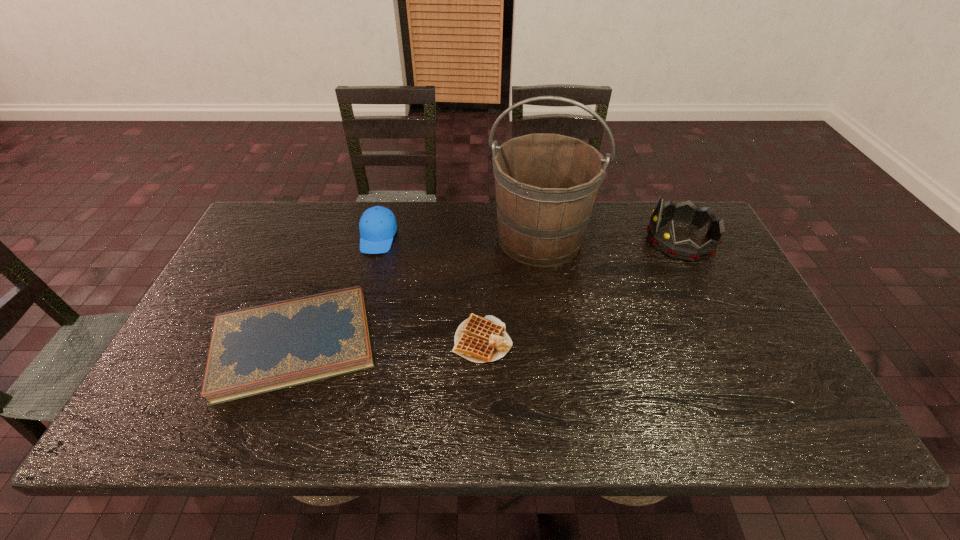
Identify the location of free space located on the front-facing side of the third shortest object. (348, 355).

Locate an element on the screen. The width and height of the screenshot is (960, 540). free space located on the right of the paperback book is located at coordinates (427, 344).

Find the location of a particular element. Image resolution: width=960 pixels, height=540 pixels. vacant space situated on the left of the waffle is located at coordinates (348, 340).

Where is `bucket that is at the far edge`? This screenshot has height=540, width=960. bucket that is at the far edge is located at coordinates (546, 184).

Identify the location of tiara situated at the far edge. (663, 239).

Find the location of a particular element. The height and width of the screenshot is (540, 960). cap situated at the far edge is located at coordinates (377, 225).

Find the location of a particular element. The height and width of the screenshot is (540, 960). object that is at the near edge is located at coordinates (254, 350).

In order to click on object at the left edge in this screenshot , I will do `click(254, 350)`.

Identify the location of object positioned at the right edge. (663, 239).

Locate an element on the screen. This screenshot has width=960, height=540. object that is at the near left corner is located at coordinates (254, 350).